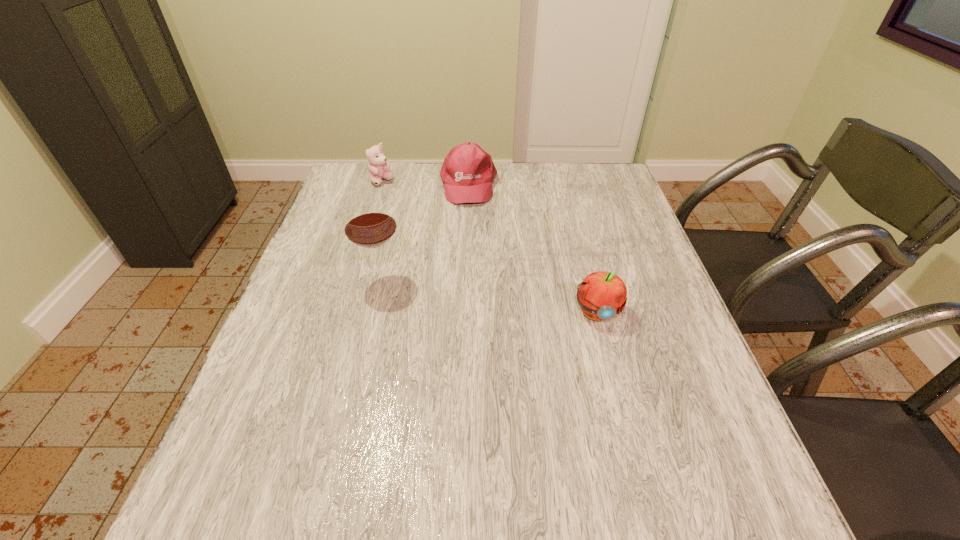
This screenshot has height=540, width=960. Identify the location of vacant spot on the desktop that is between the wineglass and the rightmost object and is positioned at the front of the baseball cap with the brim. (474, 294).

The image size is (960, 540). Identify the location of vacant space on the desktop that is between the wineglass and the apple and is positioned at the face of the teddy bear. (486, 295).